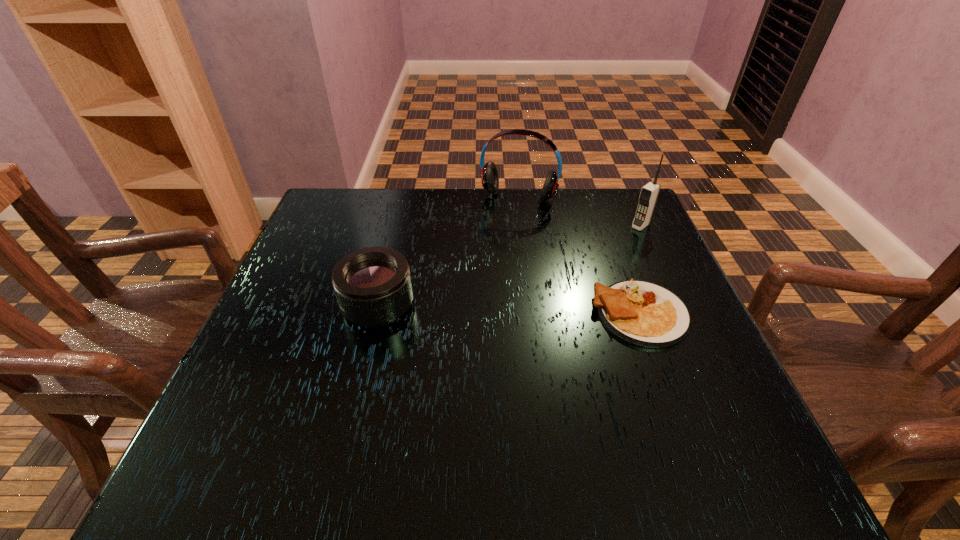
This screenshot has height=540, width=960. I want to click on object situated at the far right corner, so click(649, 193).

Locate an element on the screen. vacant region at the far edge of the desktop is located at coordinates (389, 233).

The image size is (960, 540). In the image, there is a desktop. Identify the location of vacant space at the near edge. (367, 409).

In the image, there is a desktop. Identify the location of free space at the left edge. (320, 364).

Find the location of `vacant area at the right edge of the desktop`. vacant area at the right edge of the desktop is located at coordinates (688, 375).

You are a GUI agent. You are given a task and a screenshot of the screen. Output one action in this format:
    pyautogui.click(x=<x>, y=<y>)
    Task: Click on the vacant space at the far left corner
    Image resolution: width=960 pixels, height=540 pixels.
    Given the screenshot: What is the action you would take?
    pyautogui.click(x=335, y=223)

Identify the location of free space between the cellular telephone and the headset. (580, 215).

This screenshot has width=960, height=540. Identify the location of vacant space that's between the telephoto lens and the cellular telephone. (509, 266).

Identify the location of vacant point located between the cellular telephone and the omelet. This screenshot has width=960, height=540. (640, 269).

Image resolution: width=960 pixels, height=540 pixels. I want to click on free spot between the cellular telephone and the headset, so click(x=580, y=215).